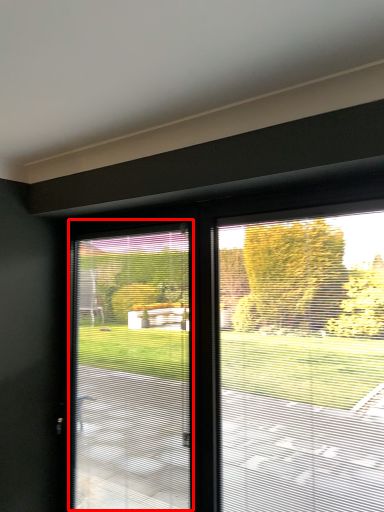
Question: Considering the relative positions of window screen (annotated by the red box) and window screen in the image provided, where is window screen (annotated by the red box) located with respect to the staircase?

Choices:
 (A) left
 (B) right

Answer: (A)